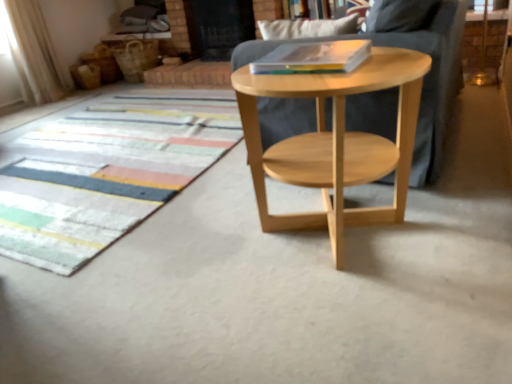
Where is `empty space that is ontop of natural wood side table at center`? empty space that is ontop of natural wood side table at center is located at coordinates (311, 67).